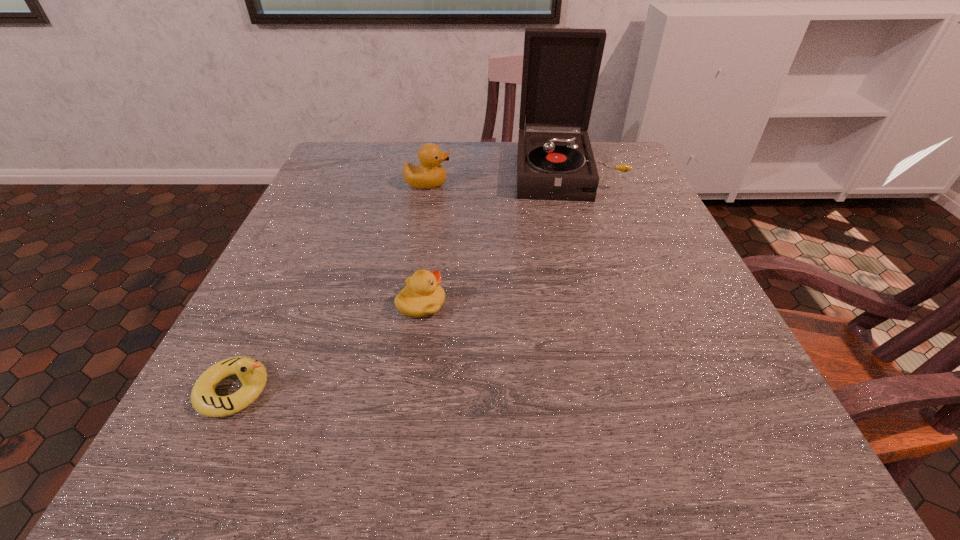
You are a GUI agent. You are given a task and a screenshot of the screen. Output one action in this format:
    pyautogui.click(x=<x>, y=<y>)
    Task: Click on the vacant area between the second farthest duckling and the farthest duckling
    The image size is (960, 540).
    Given the screenshot: What is the action you would take?
    pyautogui.click(x=424, y=244)

The image size is (960, 540). I want to click on unoccupied area between the nearest duckling and the tallest duckling, so click(x=331, y=287).

Locate an element on the screen. Image resolution: width=960 pixels, height=540 pixels. blank region between the second tallest object and the third farthest object is located at coordinates (424, 244).

Select which object is the closest to the tallest duckling. Please provide its 2D coordinates. Your answer should be formatted as a tuple, i.e. [(x, y)], where the tuple contains the x and y coordinates of a point satisfying the conditions above.

[(561, 66)]

Image resolution: width=960 pixels, height=540 pixels. In order to click on the second closest object to the leftmost object in this screenshot , I will do `click(430, 174)`.

Point out which duckling is positioned as the second nearest to the nearest duckling. Please provide its 2D coordinates. Your answer should be formatted as a tuple, i.e. [(x, y)], where the tuple contains the x and y coordinates of a point satisfying the conditions above.

[(430, 174)]

I want to click on duckling that is the closest to the tallest object, so click(x=430, y=174).

Locate an element on the screen. vacant space that satisfies the following two spatial constraints: 1. on the front side of the rightmost object; 2. on the face of the nearest object is located at coordinates (630, 390).

You are a GUI agent. You are given a task and a screenshot of the screen. Output one action in this format:
    pyautogui.click(x=<x>, y=<y>)
    Task: Click on the free space that satisfies the following two spatial constraints: 1. on the front side of the tallest object; 2. on the front-facing side of the second nearest duckling
    The height and width of the screenshot is (540, 960).
    Given the screenshot: What is the action you would take?
    pyautogui.click(x=605, y=304)